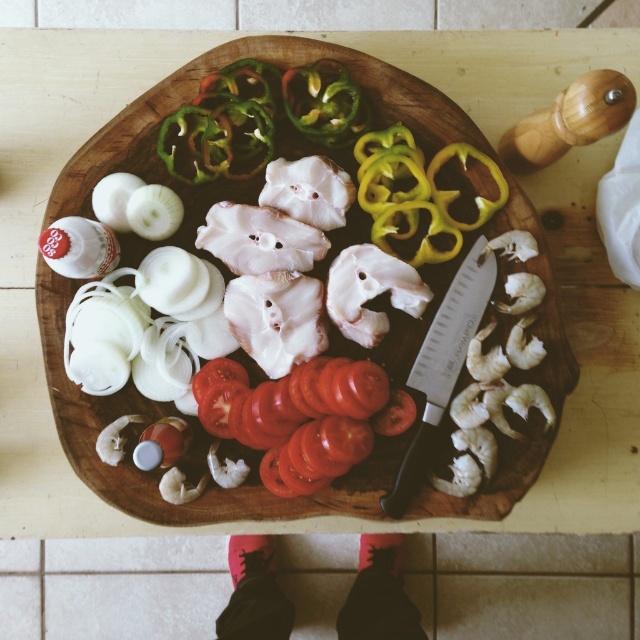
You are a chef preparing ingredients on the wooden cutting board at center. You need to place a new ingredient on the silver metallic knife at center. Can you reach the knife without moving the cutting board?

The wooden cutting board at center is in front of the silver metallic knife at center, so the knife is behind the cutting board. Therefore, you cannot reach the knife without moving the cutting board.

You are a chef holding a silver metallic knife at center. You need to cut a piece of meat that is 40 inches away from you. Can you reach it with the knife you are holding?

The silver metallic knife at center and viewer are 38.97 inches apart, so the knife is within reach since it is closer than the 40 inch distance required.

You are a chef preparing ingredients on the wooden cutting board at center. You need to place the silver metallic knife at center somewhere. Where should you put it so it doesn

The wooden cutting board at center is above the silver metallic knife at center, so you should place the knife below the cutting board to avoid obstruction.